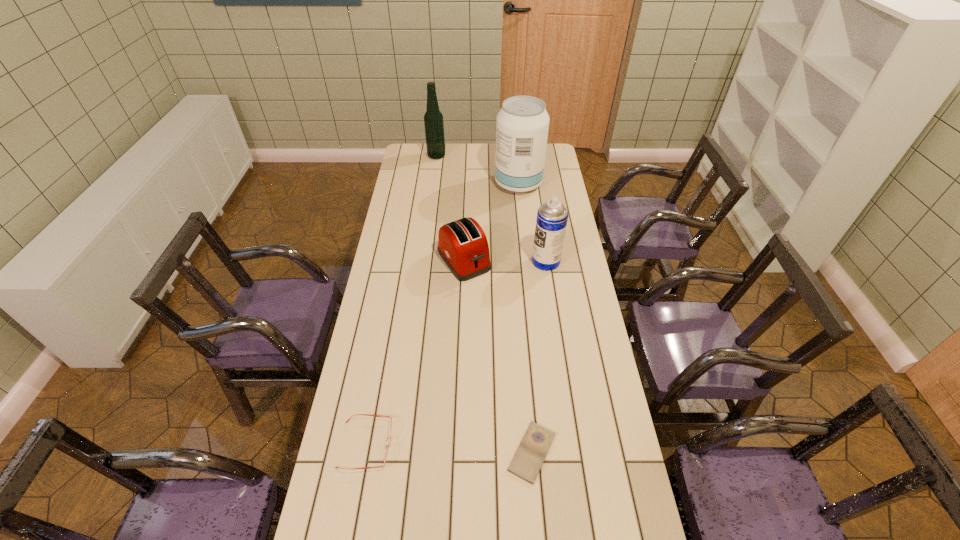
This screenshot has width=960, height=540. Identify the location of the fifth nearest object. (522, 125).

The height and width of the screenshot is (540, 960). I want to click on the nearer alcohol, so click(x=522, y=125).

You are a GUI agent. You are given a task and a screenshot of the screen. Output one action in this format:
    pyautogui.click(x=<x>, y=<y>)
    Task: Click on the left alcohol
    
    Given the screenshot: What is the action you would take?
    pyautogui.click(x=433, y=119)

This screenshot has width=960, height=540. In order to click on the farther alcohol in this screenshot , I will do `click(433, 119)`.

Locate an element on the screen. This screenshot has height=540, width=960. the fourth shortest object is located at coordinates (x=552, y=216).

Where is `toaster`? The image size is (960, 540). toaster is located at coordinates (462, 244).

This screenshot has width=960, height=540. I want to click on the third shortest object, so click(x=462, y=244).

This screenshot has width=960, height=540. What are the coordinates of `the fifth tallest object` in the screenshot? It's located at (386, 446).

You are a GUI agent. You are given a task and a screenshot of the screen. Output one action in this format:
    pyautogui.click(x=<x>, y=<y>)
    Task: Click on the shortest object
    
    Given the screenshot: What is the action you would take?
    pos(531,453)

Where is `free spot located on the left of the fifth nearest object`? This screenshot has width=960, height=540. free spot located on the left of the fifth nearest object is located at coordinates (449, 184).